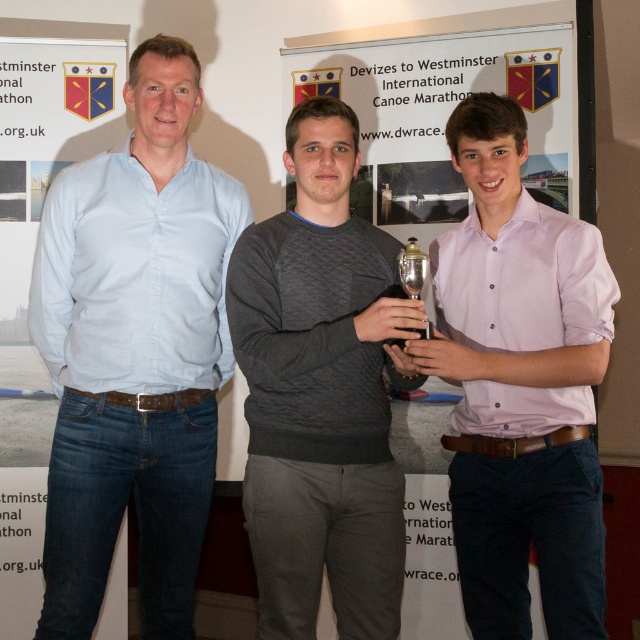
Does light blue shirt at left appear on the left side of metallic gold trophy at center?

Yes, light blue shirt at left is to the left of metallic gold trophy at center.

Is point (170, 60) less distant than point (406, 252)?

No, (170, 60) is behind (406, 252).

Does point (140, 205) come closer to viewer compared to point (424, 337)?

No, it is not.

I want to click on light blue shirt at left, so click(134, 352).

Is white paper at center positioned before metallic gold trophy at center?

No, white paper at center is behind metallic gold trophy at center.

Can you confirm if white paper at center is positioned above metallic gold trophy at center?

Correct, white paper at center is located above metallic gold trophy at center.

Is point (452, 88) closer to viewer compared to point (428, 264)?

No, (452, 88) is further to viewer.

Locate an element on the screen. The width and height of the screenshot is (640, 640). white paper at center is located at coordinates (456, 102).

Can you confirm if dark grey textured sweater at center is shorter than white paper at center?

No, dark grey textured sweater at center is not shorter than white paper at center.

Find the location of `dark grey textured sweater at center`. dark grey textured sweater at center is located at coordinates (321, 392).